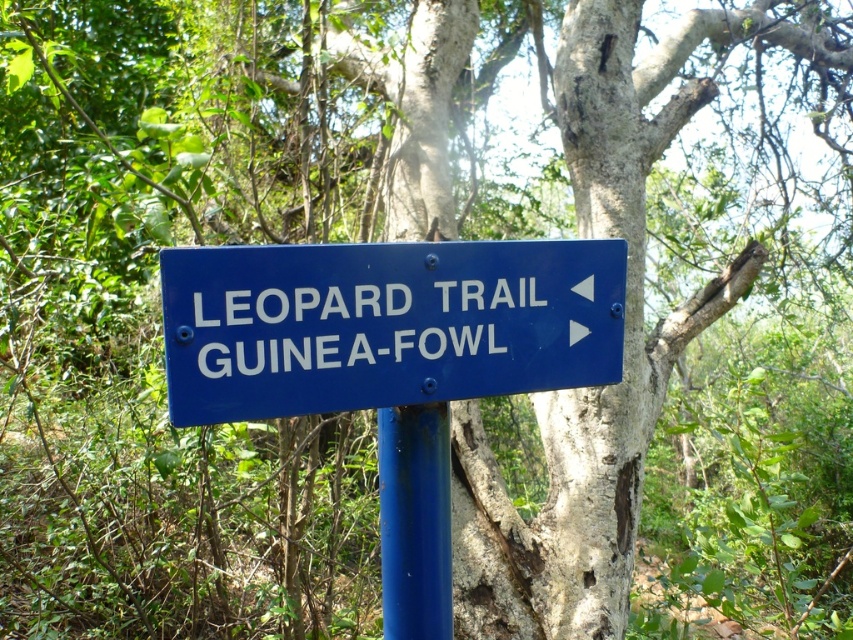
You are a hiker who needs to attach a small sticker to the blue plastic sign at center so it doesn t fall off the blue painted metal pole at center. Given that the sticker s adhesive strength can hold items up to 10 inches away from the pole, will the sticker be sufficient?

The blue plastic sign at center is 8.23 inches away from the blue painted metal pole at center. Since the sticker can hold items up to 10 inches away, the sticker will be sufficient to prevent the sign from falling off.

You are hiking and come across the blue plastic sign at center and the blue painted metal pole at center. Which object is positioned higher relative to the ground?

The blue plastic sign at center is above the blue painted metal pole at center, so it is positioned higher relative to the ground.